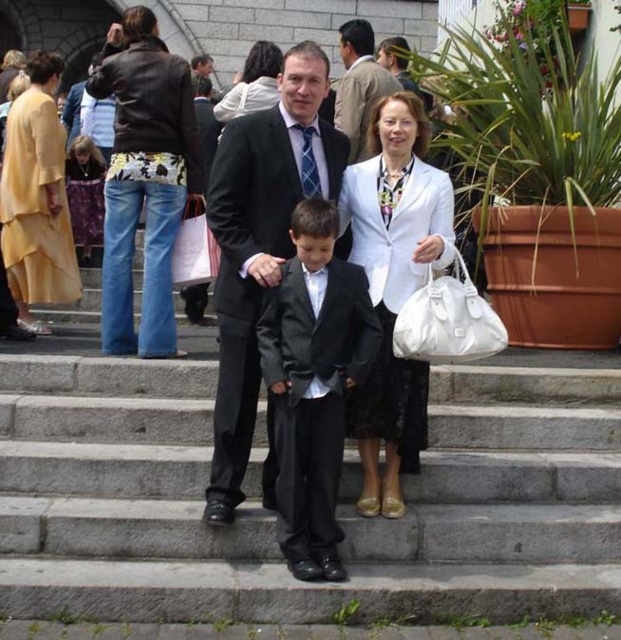
Question: Does white satin blazer at center appear on the left side of white leather handbag at center?

Choices:
 (A) yes
 (B) no

Answer: (A)

Question: Which point is farther from the camera taking this photo?

Choices:
 (A) (57, 205)
 (B) (258, 44)

Answer: (B)

Question: Which of the following is the closest to the observer?

Choices:
 (A) (40, 474)
 (B) (70, 241)
 (C) (268, 100)

Answer: (A)

Question: Does black satin suit at center appear over matte purple dress at left?

Choices:
 (A) no
 (B) yes

Answer: (A)

Question: Can you confirm if leather jacket at upper left is thinner than matte black suit at center?

Choices:
 (A) no
 (B) yes

Answer: (A)

Question: Which object is farther from the camera taking this photo?

Choices:
 (A) shiny black suit at center
 (B) white satin blazer at center

Answer: (B)